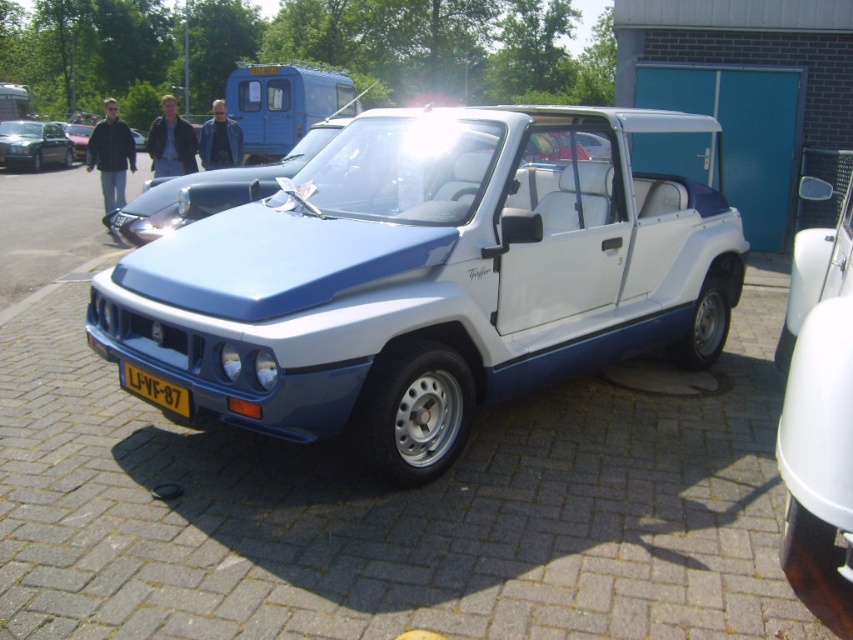
Can you confirm if metallic silver car at left is positioned above yellow plastic license plate at center?

Indeed, metallic silver car at left is positioned over yellow plastic license plate at center.

Who is taller, metallic silver car at left or yellow plastic license plate at center?

With more height is metallic silver car at left.

Where is `metallic silver car at left`? metallic silver car at left is located at coordinates (33, 145).

Is blue metallic car at center positioned before yellow plastic license plate at center?

Yes, blue metallic car at center is closer to the viewer.

Is blue metallic car at center thinner than yellow plastic license plate at center?

In fact, blue metallic car at center might be wider than yellow plastic license plate at center.

The height and width of the screenshot is (640, 853). Identify the location of blue metallic car at center. (431, 276).

Between blue metallic car at center and metallic silver car at left, which one appears on the right side from the viewer's perspective?

blue metallic car at center

Is point (618, 262) farther from viewer compared to point (21, 145)?

No, (618, 262) is closer to viewer.

I want to click on blue metallic car at center, so click(431, 276).